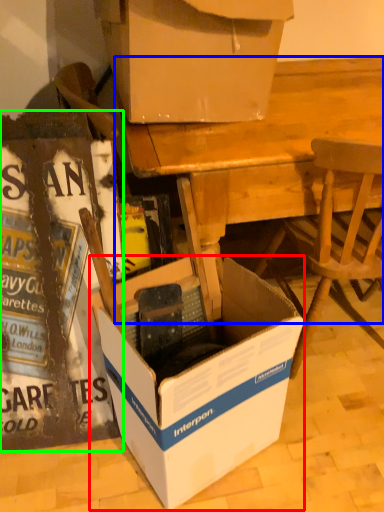
Question: Considering the real-world distances, which object is closest to box (highlighted by a red box)? desk (highlighted by a blue box) or box (highlighted by a green box).

Choices:
 (A) desk
 (B) box

Answer: (B)